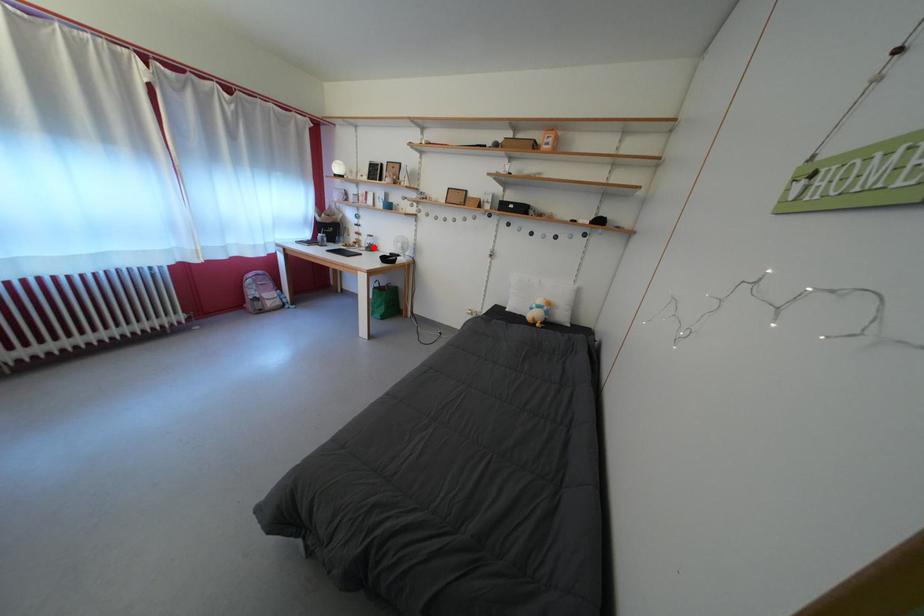
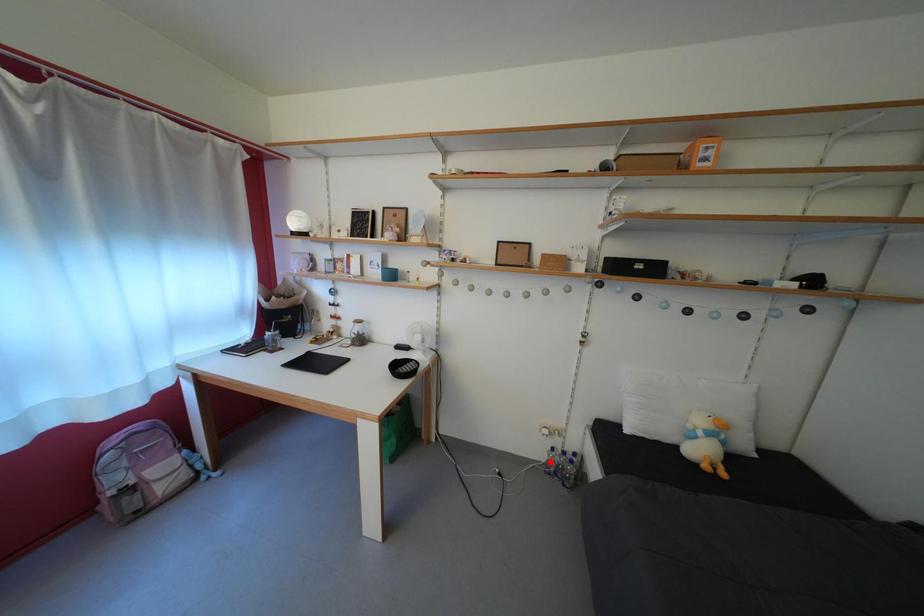
I am providing you with two images of the same scene from different viewpoints. A red point is marked on the first image and another point is marked on the second image. Is the marked point in image1 the same physical position as the marked point in image2?

No